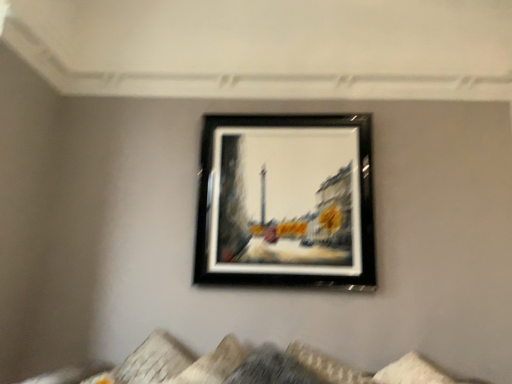
I want to click on black glossy picture frame at upper center, so click(x=286, y=201).

Measure the distance between point (x=362, y=260) and camera.

Point (x=362, y=260) is 2.29 meters from camera.

What do you see at coordinates (286, 201) in the screenshot?
I see `black glossy picture frame at upper center` at bounding box center [286, 201].

Image resolution: width=512 pixels, height=384 pixels. Identify the location of black glossy picture frame at upper center. (286, 201).